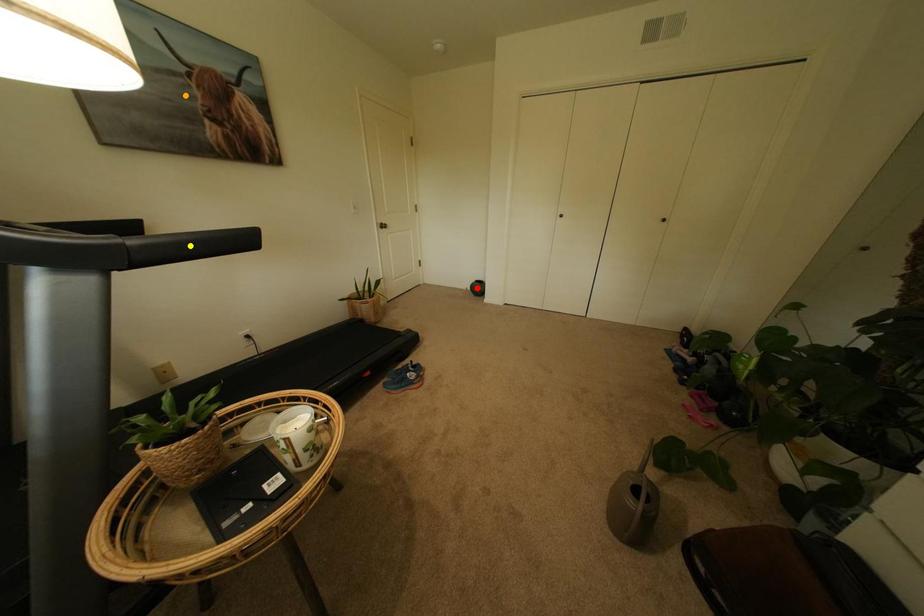
Order these from nearest to farthest:
orange point
red point
yellow point

1. red point
2. orange point
3. yellow point